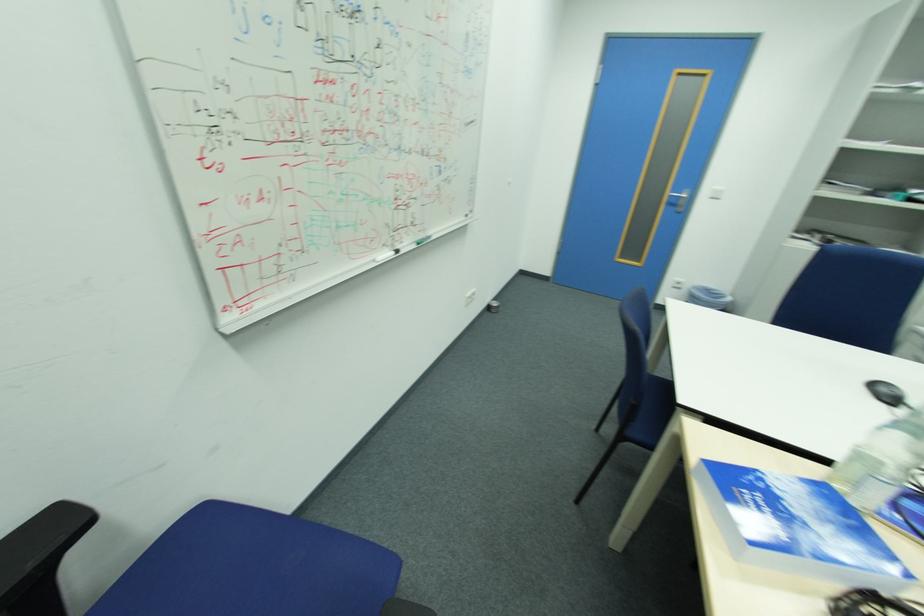
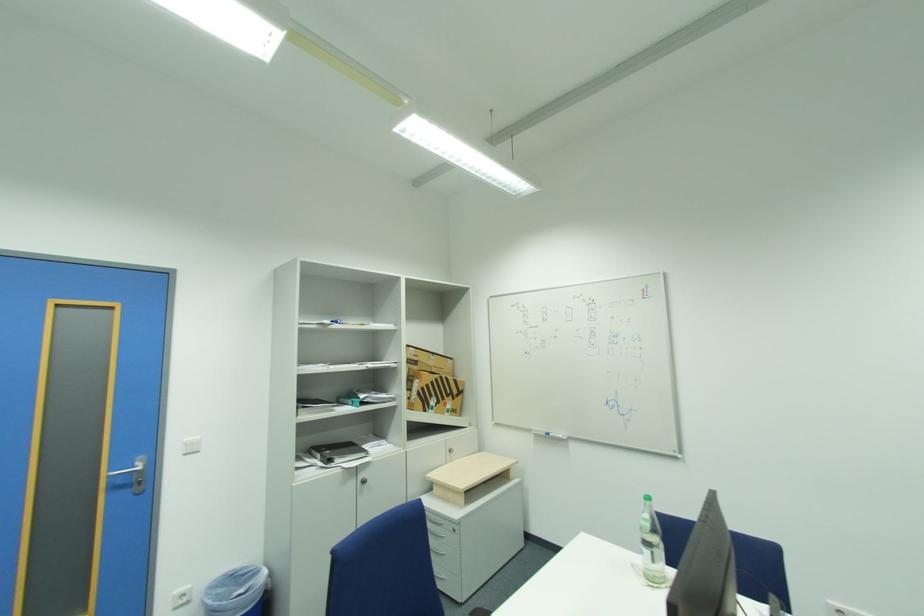
Question: The camera is either moving clockwise (left) or counter-clockwise (right) around the object. The first image is from the beginning of the video and the second image is from the end. Is the camera moving left or right when shooting the video?

Choices:
 (A) Left
 (B) Right

Answer: (A)